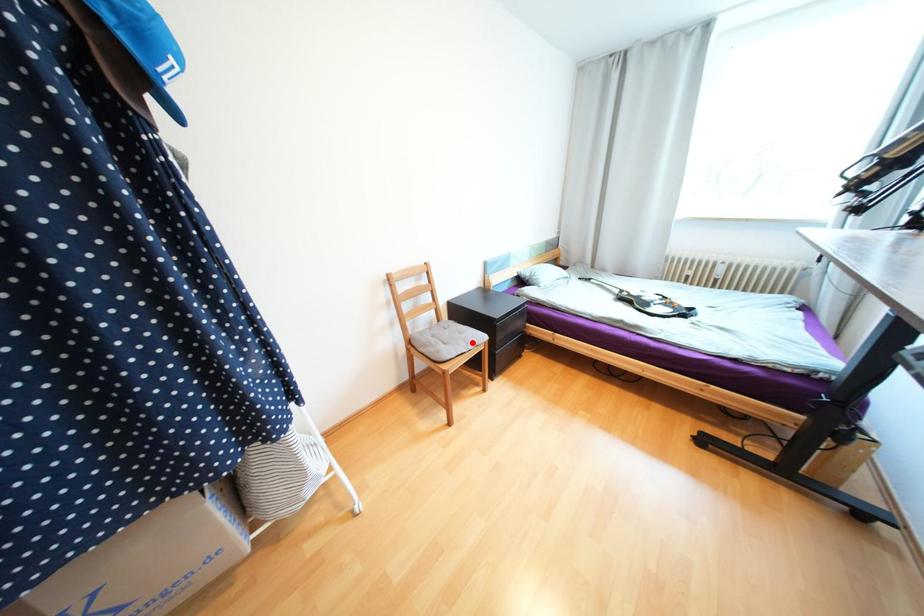
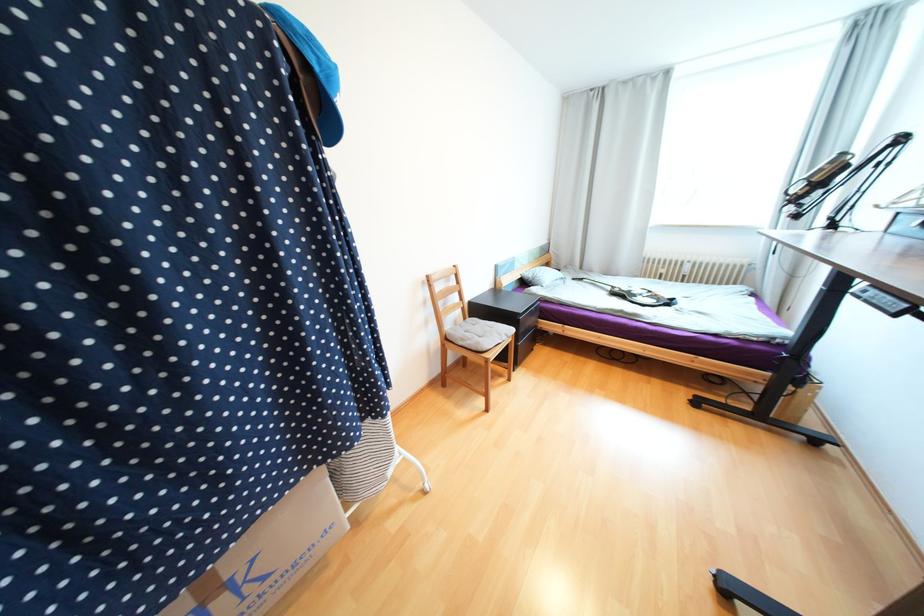
Question: I am providing you with two images of the same scene from different viewpoints. Image1 has a red point marked. In image2, the corresponding 3D location appears at what relative position? Reply with the corresponding letter.

Choices:
 (A) Closer
 (B) Farther

Answer: (B)